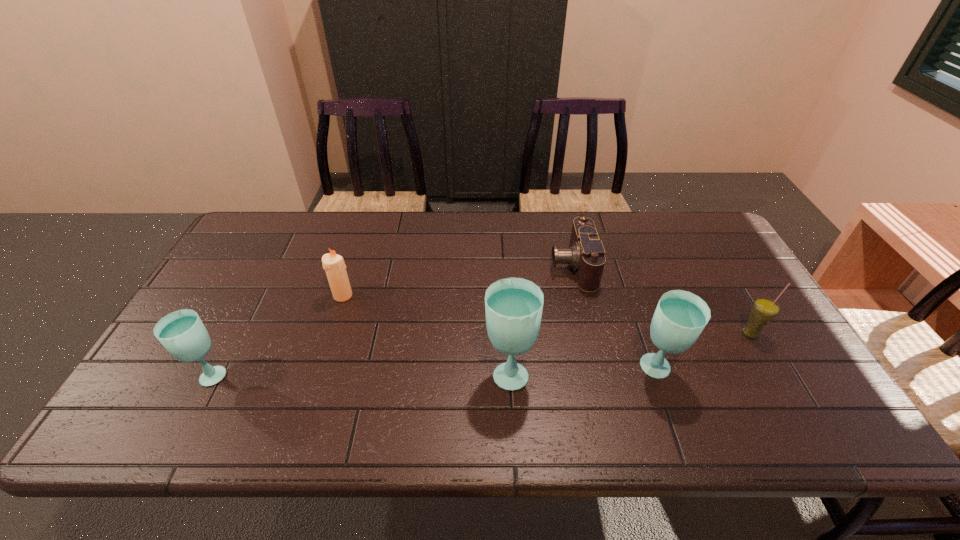
This screenshot has height=540, width=960. What are the coordinates of `the closest glass to the fourth object from right to left` in the screenshot? It's located at (680, 317).

Locate an element on the screen. The height and width of the screenshot is (540, 960). vacant region that satisfies the following two spatial constraints: 1. on the back side of the straw for drinking; 2. on the front-facing side of the camera is located at coordinates (710, 265).

This screenshot has width=960, height=540. Identify the location of vacant space that satisfies the following two spatial constraints: 1. on the front-facing side of the shortest object; 2. on the left side of the rightmost object. (588, 334).

Locate an element on the screen. free space that satisfies the following two spatial constraints: 1. on the back side of the leftmost object; 2. on the right side of the third farthest object is located at coordinates (231, 334).

Image resolution: width=960 pixels, height=540 pixels. What are the coordinates of `free space that satisfies the following two spatial constraints: 1. on the front-facing side of the shortest object; 2. on the back side of the second shortest glass` in the screenshot? It's located at (596, 370).

At what (x,y) coordinates should I click in order to perform the action: click on free space that satisfies the following two spatial constraints: 1. on the front-facing side of the third object from right to left; 2. on the front side of the fifth object from right to left. Please return your answer as a coordinate pair (x, y). This screenshot has width=960, height=540. Looking at the image, I should click on (579, 295).